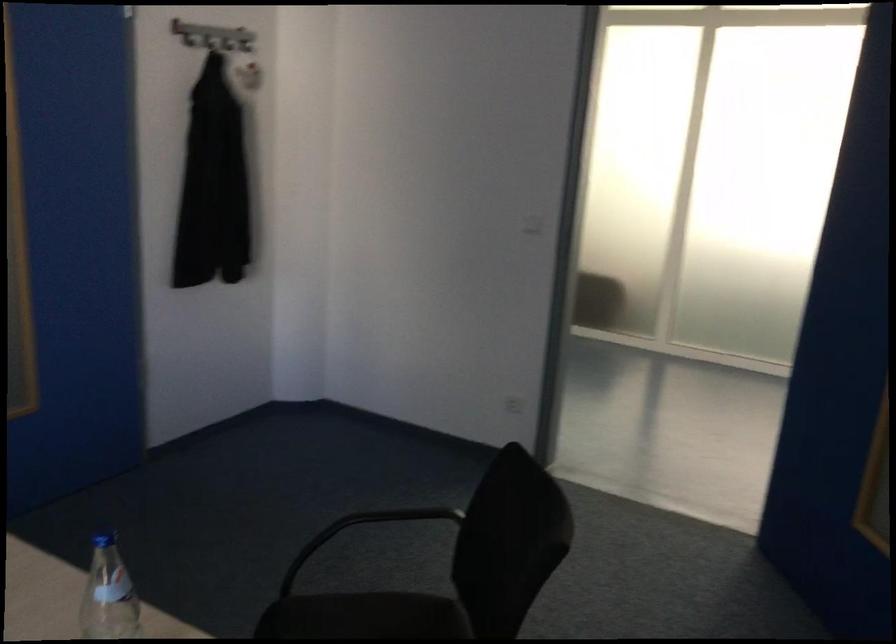
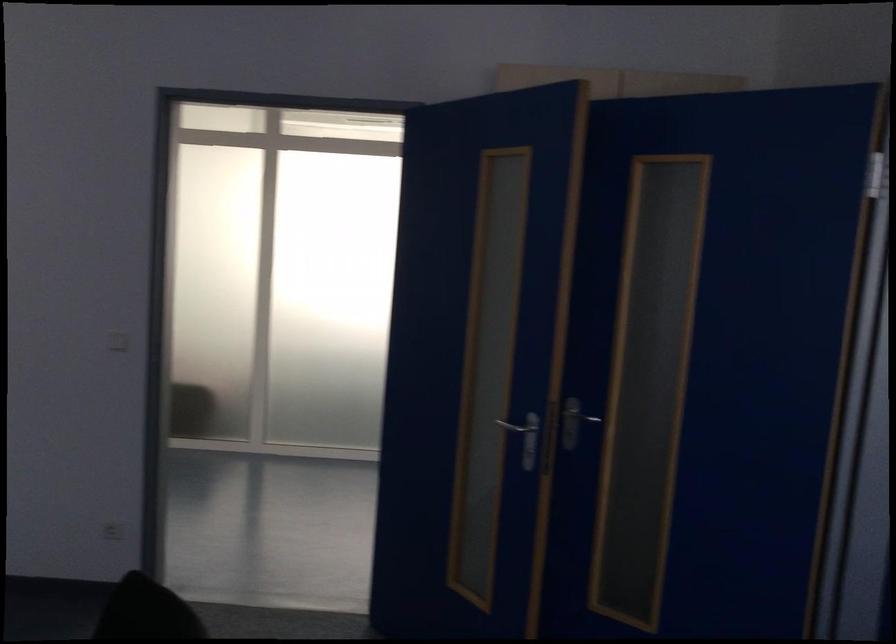
Where in the second image is the point corresponding to pixel 524 220 from the first image?

(117, 341)